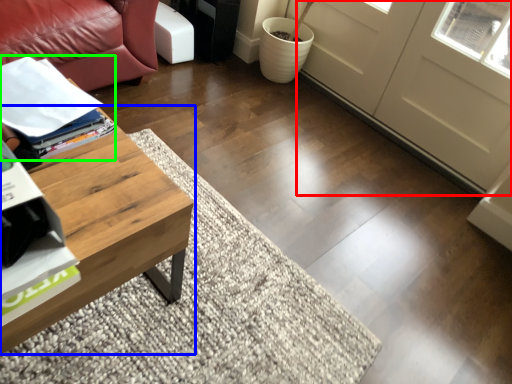
Question: Considering the real-world distances, which object is farthest from screen door (highlighted by a red box)? coffee table (highlighted by a blue box) or magazine (highlighted by a green box)?

Choices:
 (A) coffee table
 (B) magazine

Answer: (A)